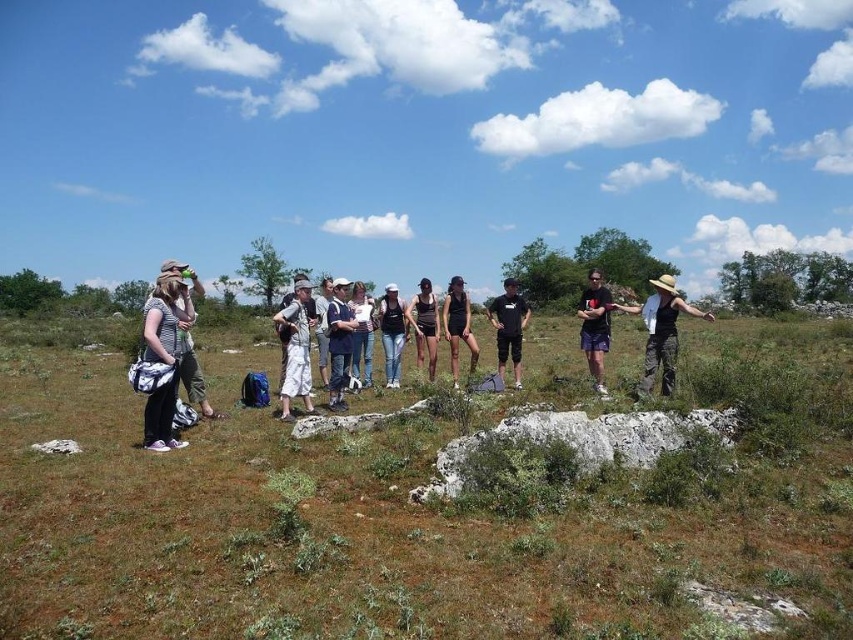
Question: Which object is farther from the camera taking this photo?

Choices:
 (A) green grassy field at center
 (B) black fabric tank top at center
 (C) black matte shirt at center

Answer: (C)

Question: Can you confirm if black matte dress at center is smaller than white cotton shirt at center?

Choices:
 (A) yes
 (B) no

Answer: (B)

Question: Which object is the farthest from the black matte shirt at center?

Choices:
 (A) black fabric tank top at center
 (B) white cotton pants at center
 (C) striped fabric backpack at left
 (D) green grassy field at center

Answer: (D)

Question: Which point is farther to the camera?

Choices:
 (A) black fabric tank top at center
 (B) striped fabric backpack at left

Answer: (A)

Question: Can you confirm if striped fabric backpack at left is bigger than black fabric hat at center?

Choices:
 (A) yes
 (B) no

Answer: (B)

Question: Is green grassy field at center above black fabric tank top at center?

Choices:
 (A) no
 (B) yes

Answer: (A)